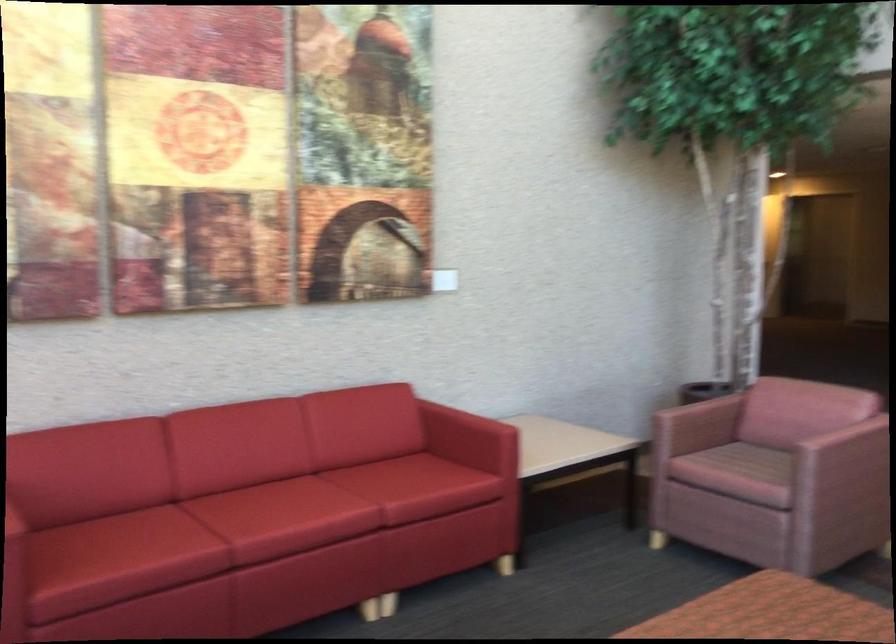
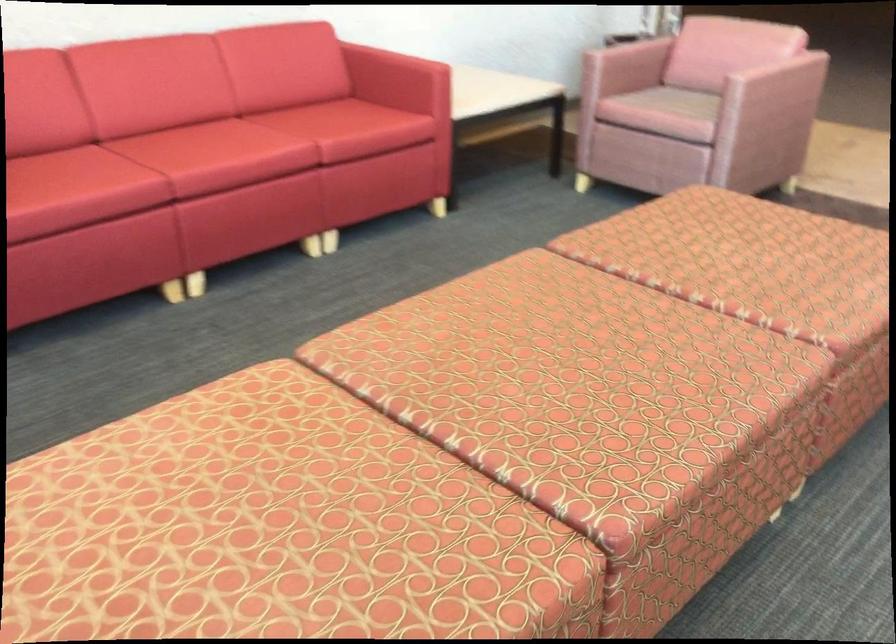
Locate, in the second image, the point that corresponds to point 264,507 in the first image.

(196, 144)